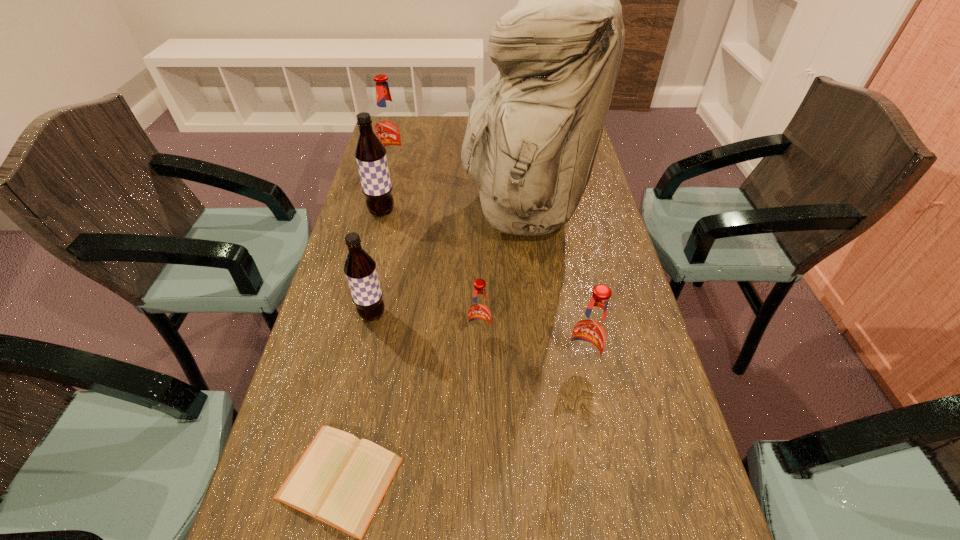
Find the location of a particular element. The image size is (960, 540). backpack is located at coordinates (533, 131).

The width and height of the screenshot is (960, 540). Identify the location of the leftmost red root beer. (388, 128).

You are a GUI agent. You are given a task and a screenshot of the screen. Output one action in this format:
    pyautogui.click(x=<x>, y=<y>)
    Task: Click on the farthest red root beer
    The height and width of the screenshot is (540, 960).
    Given the screenshot: What is the action you would take?
    pyautogui.click(x=388, y=128)

Find the location of a particular element. The image size is (960, 540). the second farthest root beer is located at coordinates (370, 153).

This screenshot has height=540, width=960. What are the coordinates of `the farther brown root beer` in the screenshot? It's located at pyautogui.click(x=370, y=153).

Image resolution: width=960 pixels, height=540 pixels. I want to click on the third farthest root beer, so click(360, 269).

At what (x,y) coordinates should I click in order to perform the action: click on the smaller brown root beer. Please return your answer as a coordinate pair (x, y). Looking at the image, I should click on (360, 269).

Locate an element on the screen. Image resolution: width=960 pixels, height=540 pixels. the rightmost red root beer is located at coordinates (590, 333).

Identify the location of the nearest red root beer. (590, 333).

This screenshot has height=540, width=960. Identify the location of the fifth farthest object. click(479, 312).